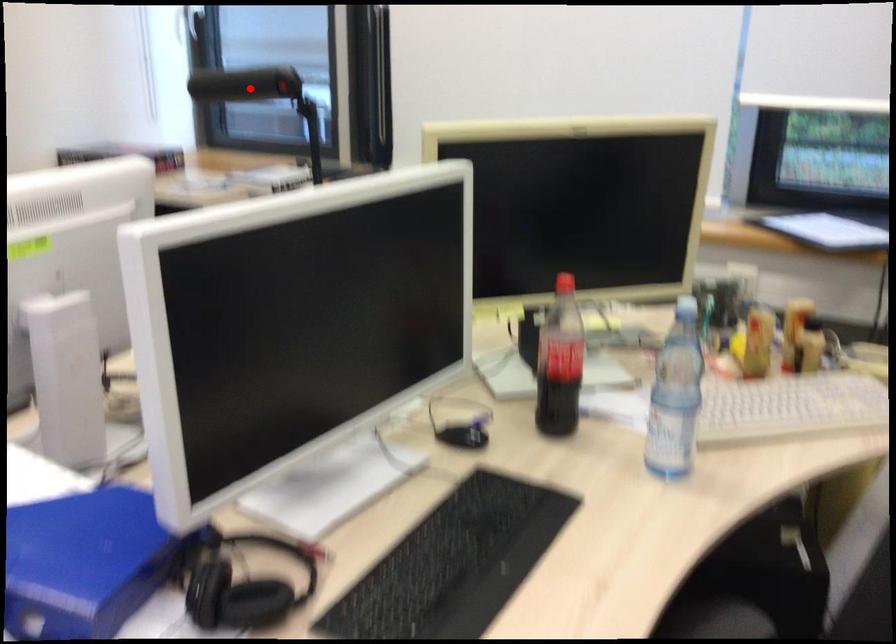
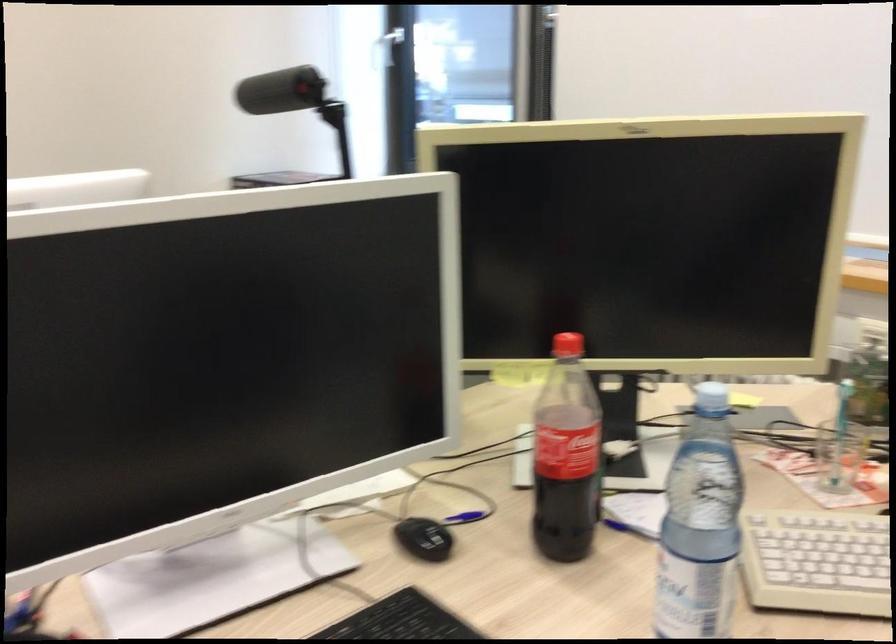
Question: A red point is marked in image1. In image2, is the corresponding 3D point closer to the camera or farther? Reply with the corresponding letter.

Choices:
 (A) The corresponding 3D point is closer.
 (B) The corresponding 3D point is farther.

Answer: (A)